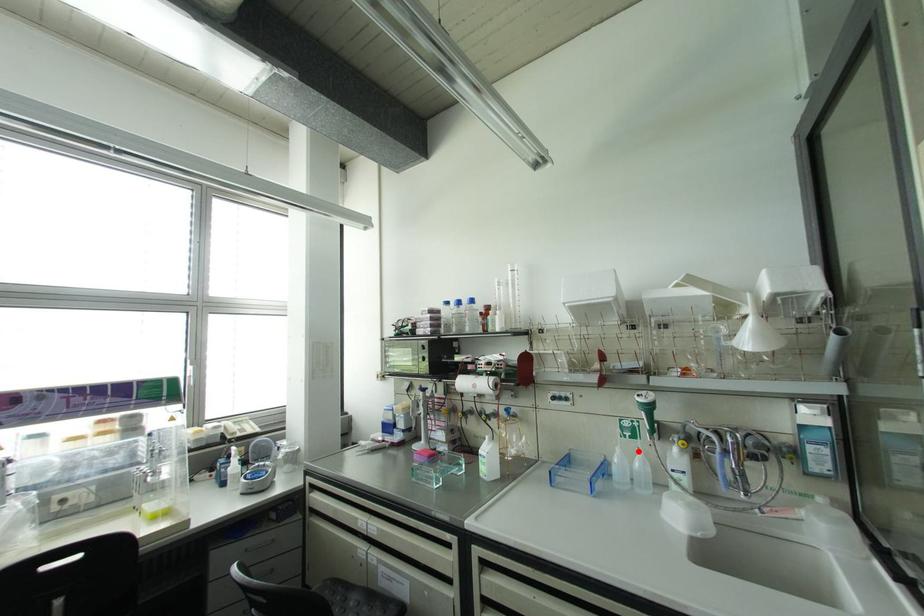
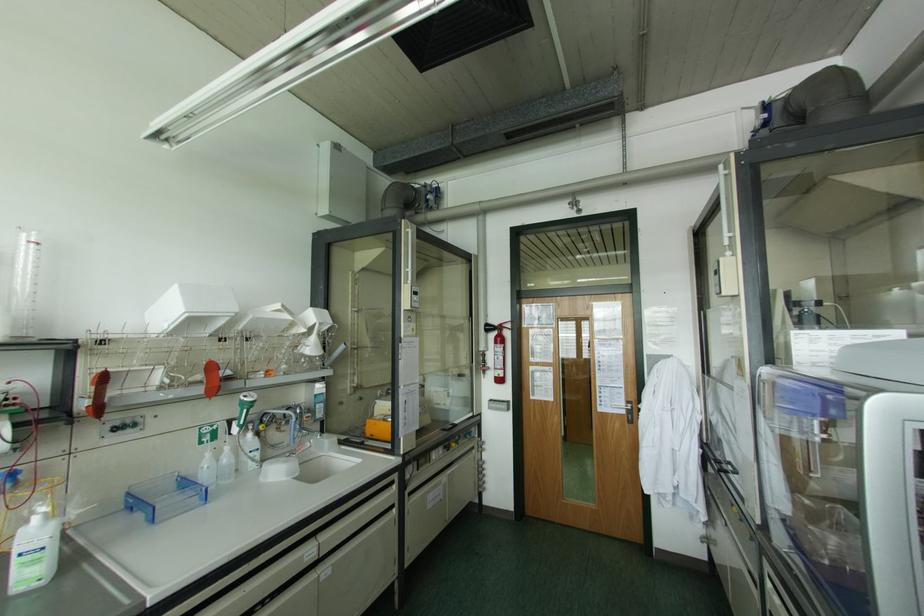
In the second image, find the point that corresponds to the highlighted location in the first image.

(226, 448)